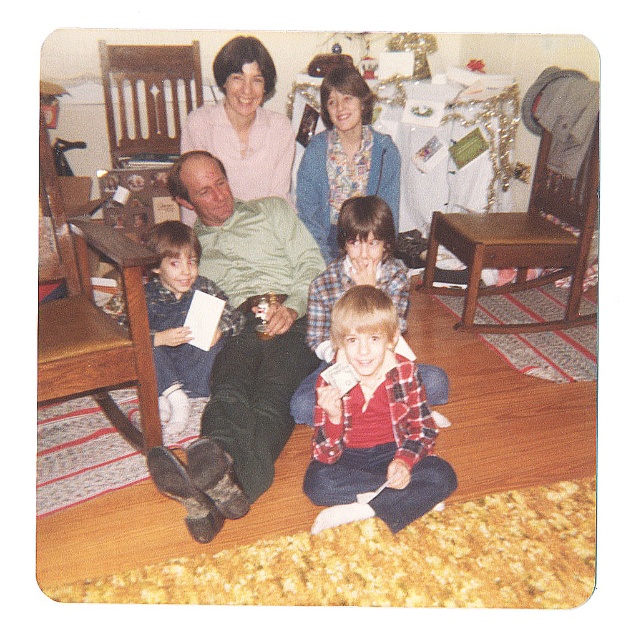
Question: Does green wool sweater at center appear on the left side of light pink fabric at upper center?

Choices:
 (A) no
 (B) yes

Answer: (A)

Question: Is green wool sweater at center thinner than flannel shirt at center?

Choices:
 (A) no
 (B) yes

Answer: (A)

Question: Among these points, which one is nearest to the camera?

Choices:
 (A) [349, 134]
 (B) [585, 186]

Answer: (B)

Question: Which of the following is the closest to the observer?

Choices:
 (A) (449, 230)
 (B) (252, 177)
 (C) (327, 502)
 (D) (324, 176)

Answer: (C)

Question: Does flannel shirt at center have a lesser width compared to blue textured sweater at upper center?

Choices:
 (A) no
 (B) yes

Answer: (B)

Question: Which point is closer to the camera?

Choices:
 (A) flannel shirt at center
 (B) blue textured sweater at upper center
 (C) light pink fabric at upper center

Answer: (A)